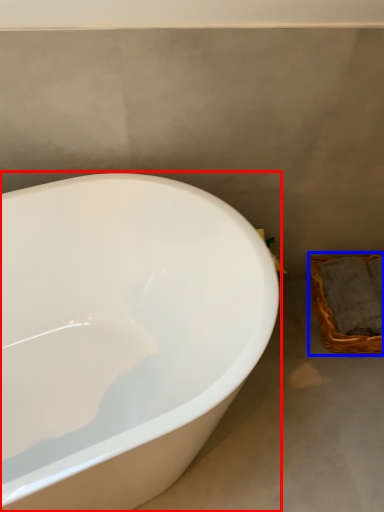
Question: Which of the following is the closest to the observer, bathtub (highlighted by a red box) or basket (highlighted by a blue box)?

Choices:
 (A) bathtub
 (B) basket

Answer: (A)